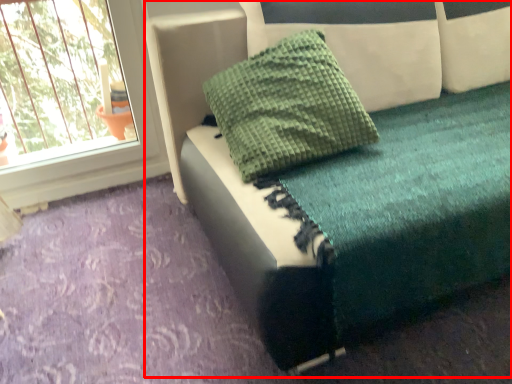
Question: From the image's perspective, where is furniture (annotated by the red box) located relative to pillow?

Choices:
 (A) above
 (B) below

Answer: (A)